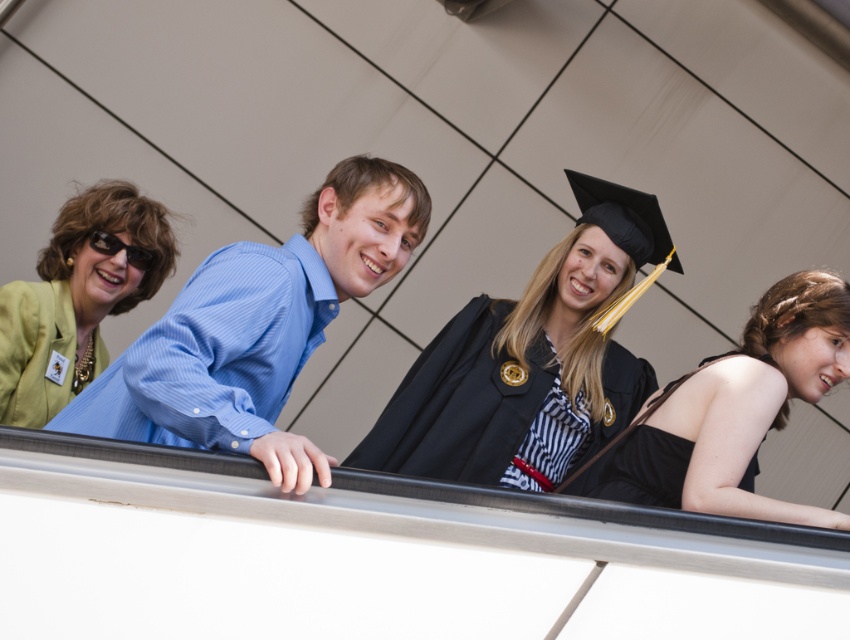
Question: Which of the following is the closest to the observer?

Choices:
 (A) black satin gown at lower right
 (B) green fabric jacket at left
 (C) blue shirt at center

Answer: (C)

Question: Is black matte graduation gown at center in front of black satin dress at center?

Choices:
 (A) yes
 (B) no

Answer: (B)

Question: Which point is farther from the camera taking this photo?

Choices:
 (A) (103, 348)
 (B) (191, 324)
 (C) (609, 451)

Answer: (A)

Question: Does blue shirt at center have a greater width compared to black matte graduation gown at center?

Choices:
 (A) no
 (B) yes

Answer: (A)

Question: Which point appears farthest from the camera in this image?

Choices:
 (A) (664, 458)
 (B) (811, 289)
 (C) (176, 376)

Answer: (B)

Question: Can you confirm if blue shirt at center is smaller than black satin dress at center?

Choices:
 (A) no
 (B) yes

Answer: (A)